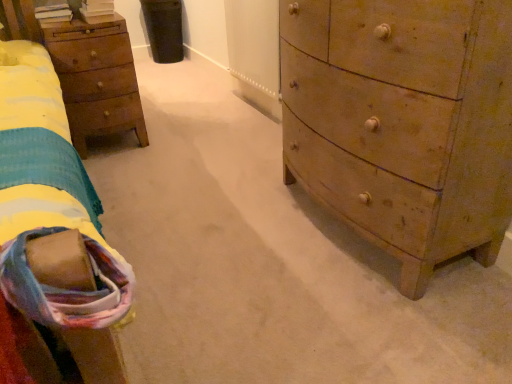
Question: Does wooden chest of drawers at right have a smaller size compared to wooden nightstand at left?

Choices:
 (A) yes
 (B) no

Answer: (B)

Question: Can you confirm if wooden chest of drawers at right is wider than wooden nightstand at left?

Choices:
 (A) no
 (B) yes

Answer: (B)

Question: Does wooden chest of drawers at right have a greater height compared to wooden nightstand at left?

Choices:
 (A) no
 (B) yes

Answer: (B)

Question: Can you confirm if wooden chest of drawers at right is positioned to the right of wooden nightstand at left?

Choices:
 (A) yes
 (B) no

Answer: (A)

Question: Does wooden chest of drawers at right have a lesser height compared to wooden nightstand at left?

Choices:
 (A) no
 (B) yes

Answer: (A)

Question: From a real-world perspective, is soft cotton blanket at lower left physically located above or below wooden nightstand at left?

Choices:
 (A) below
 (B) above

Answer: (B)

Question: From the image's perspective, is soft cotton blanket at lower left located above or below wooden nightstand at left?

Choices:
 (A) below
 (B) above

Answer: (A)

Question: Is soft cotton blanket at lower left inside or outside of wooden nightstand at left?

Choices:
 (A) outside
 (B) inside

Answer: (A)

Question: Looking at the image, does soft cotton blanket at lower left seem bigger or smaller compared to wooden nightstand at left?

Choices:
 (A) big
 (B) small

Answer: (B)

Question: Is wooden nightstand at left taller or shorter than soft cotton blanket at lower left?

Choices:
 (A) short
 (B) tall

Answer: (B)

Question: Is wooden nightstand at left situated inside soft cotton blanket at lower left or outside?

Choices:
 (A) outside
 (B) inside

Answer: (A)

Question: In the image, is wooden nightstand at left on the left side or the right side of soft cotton blanket at lower left?

Choices:
 (A) right
 (B) left

Answer: (B)

Question: Relative to soft cotton blanket at lower left, is wooden nightstand at left in front or behind?

Choices:
 (A) behind
 (B) front

Answer: (A)

Question: Is wooden nightstand at left to the left or to the right of wooden chest of drawers at right in the image?

Choices:
 (A) right
 (B) left

Answer: (B)

Question: Do you think wooden nightstand at left is within wooden chest of drawers at right, or outside of it?

Choices:
 (A) inside
 (B) outside

Answer: (B)